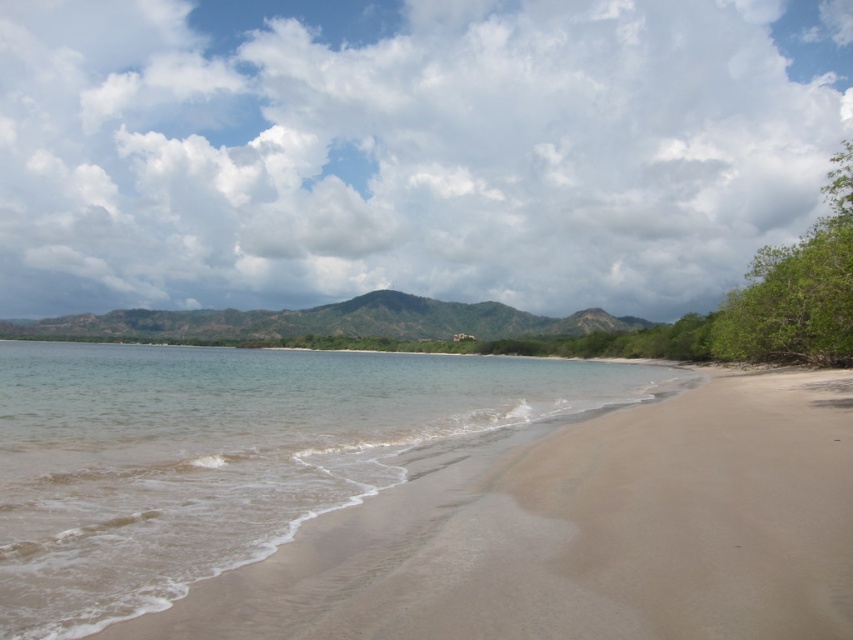
In the scene shown: You are standing on the beach and want to take a photo of the green textured mountain at center and the clear water at beach center. Which object should you point your camera towards first if you want to capture both in one shot?

You should point your camera towards the green textured mountain at center first because it is to the left of the clear water at beach center, so capturing it first will ensure both objects are included in the frame.

You are standing at the coordinates of the clear water at beach center. Looking towards the hills in the background, which direction should you face to see the green vegetation of the mangroves?

The green vegetation of the mangroves is in the middle ground between you and the hills. Since you are facing the hills, the mangroves would be behind you. To see them, you should turn around and face the opposite direction.

You are a hiker who wants to cross from the clear water at beach center to the green textured mountain at center. Given that your hiking boots can handle up to 150 meters of distance, will you be able to make the crossing without needing to rest?

The distance between the clear water at beach center and the green textured mountain at center is 142.12 meters, which is within the 150 meters limit of your hiking boots. Therefore, you can make the crossing without needing to rest.